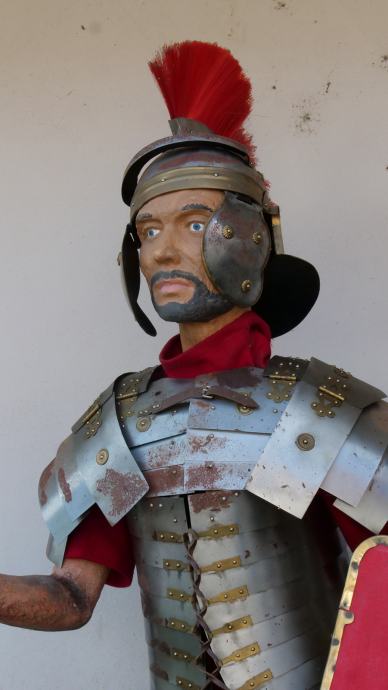
Where is `hinge`? Image resolution: width=388 pixels, height=690 pixels. hinge is located at coordinates (335, 393), (286, 377), (137, 382), (97, 417).